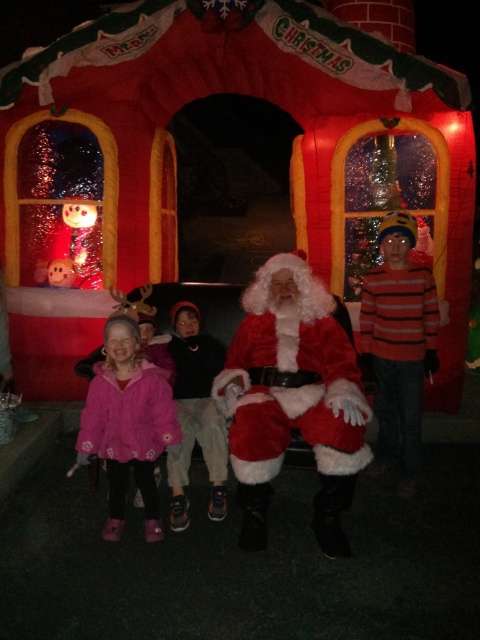
Question: Which of the following is the farthest from the observer?

Choices:
 (A) (126, 394)
 (B) (248, 339)

Answer: (B)

Question: Among these points, which one is nearest to the camera?

Choices:
 (A) (391, 352)
 (B) (313, 513)
 (C) (119, 346)

Answer: (C)

Question: Does fuzzy red santa at center have a greater width compared to pink fleece jacket at lower left?

Choices:
 (A) no
 (B) yes

Answer: (B)

Question: Can you confirm if fuzzy white santa at center is positioned to the right of pink fleece jacket at lower left?

Choices:
 (A) no
 (B) yes

Answer: (B)

Question: Among these objects, which one is nearest to the camera?

Choices:
 (A) fuzzy white santa at center
 (B) pink fleece jacket at lower left

Answer: (A)

Question: Observing the image, what is the correct spatial positioning of fuzzy white santa at center in reference to pink fleece jacket at lower left?

Choices:
 (A) above
 (B) below

Answer: (A)